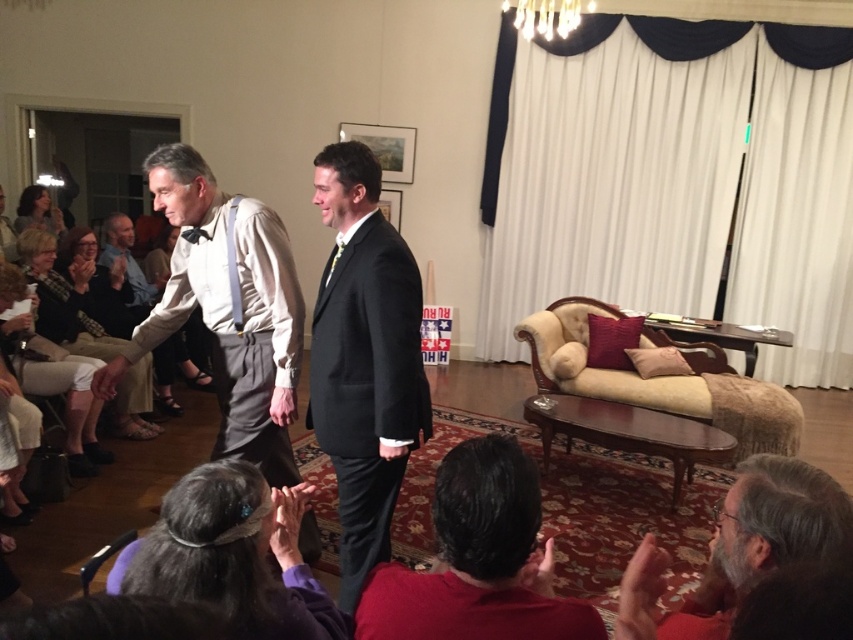
Question: Can you confirm if light brown fabric couch at left is thinner than matte black hair at upper left?

Choices:
 (A) no
 (B) yes

Answer: (B)

Question: Which point appears farthest from the camera in this image?

Choices:
 (A) (105, 280)
 (B) (242, 627)
 (C) (775, 547)

Answer: (A)

Question: Is black satin suit at center smaller than light brown fabric couch at left?

Choices:
 (A) no
 (B) yes

Answer: (B)

Question: Estimate the real-world distances between objects in this image. Which object is closer to the matte gray suit at center?

Choices:
 (A) matte black hair at upper left
 (B) purple fabric headband at lower center
 (C) dark red sweater at lower center

Answer: (B)

Question: Which of these objects is positioned farthest from the light beige pants at lower left?

Choices:
 (A) gray wool sweater at lower right
 (B) matte black bow tie at center
 (C) purple fabric headband at lower center

Answer: (A)

Question: Does dark red sweater at lower center have a lesser width compared to light beige pants at lower left?

Choices:
 (A) no
 (B) yes

Answer: (B)